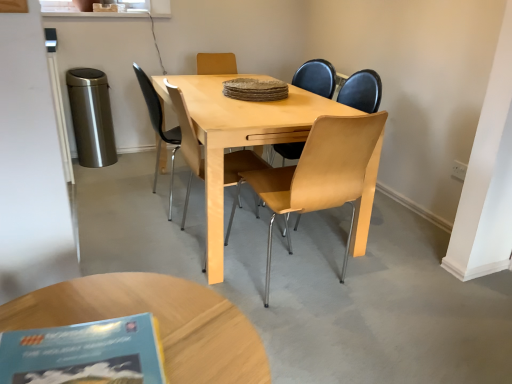
Image resolution: width=512 pixels, height=384 pixels. Describe the element at coordinates (159, 322) in the screenshot. I see `light brown wooden coffee table at lower center` at that location.

This screenshot has height=384, width=512. Describe the element at coordinates (187, 141) in the screenshot. I see `light brown wood chair at center, which is counted as the 2th chair, starting from the right` at that location.

Image resolution: width=512 pixels, height=384 pixels. In order to click on light wood/metallic chair at center, marked as the second chair in a left-to-right arrangement in this screenshot , I will do `click(317, 175)`.

Image resolution: width=512 pixels, height=384 pixels. Find the location of `light brown wooden coffee table at lower center`. light brown wooden coffee table at lower center is located at coordinates (159, 322).

Would you say light brown wooden coffee table at lower center is to the left or to the right of light brown wood chair at center, which is counted as the 2th chair, starting from the right, in the picture?

Based on their positions, light brown wooden coffee table at lower center is located to the left of light brown wood chair at center, which is counted as the 2th chair, starting from the right.

Is light brown wood chair at center, which is counted as the 2th chair, starting from the right, completely or partially inside light brown wooden coffee table at lower center?

That's incorrect, light brown wood chair at center, which is counted as the 2th chair, starting from the right, is not inside light brown wooden coffee table at lower center.

Considering the positions of points (165, 354) and (200, 152), is point (165, 354) closer to camera compared to point (200, 152)?

Yes, it is in front of point (200, 152).

Is light brown wood chair at center, positioned as the 1th chair in left-to-right order, far from light brown wooden coffee table at lower center?

Yes, light brown wood chair at center, positioned as the 1th chair in left-to-right order, and light brown wooden coffee table at lower center are located far from each other.

Which object is further away from the camera taking this photo, light brown wood chair at center, positioned as the 1th chair in left-to-right order, or light brown wooden coffee table at lower center?

light brown wood chair at center, positioned as the 1th chair in left-to-right order, is further away from the camera.

Does light brown wood chair at center, positioned as the 1th chair in left-to-right order, turn towards light brown wooden coffee table at lower center?

No, light brown wood chair at center, positioned as the 1th chair in left-to-right order, does not turn towards light brown wooden coffee table at lower center.

Consider the image. Can you tell me how much light brown wood chair at center, which is counted as the 2th chair, starting from the right, and light brown wooden coffee table at lower center differ in facing direction?

The facing directions of light brown wood chair at center, which is counted as the 2th chair, starting from the right, and light brown wooden coffee table at lower center are 89.2 degrees apart.

From a real-world perspective, is light brown wooden coffee table at lower center physically below blue paper book at lower left?

Yes, from a real-world perspective, light brown wooden coffee table at lower center is beneath blue paper book at lower left.

Is light brown wooden coffee table at lower center facing towards blue paper book at lower left?

No, light brown wooden coffee table at lower center is not oriented towards blue paper book at lower left.

You are a GUI agent. You are given a task and a screenshot of the screen. Output one action in this format:
    pyautogui.click(x=<x>, y=<y>)
    Task: Click on the coffee table below the blue paper book at lower left (from the image's perspective)
    
    Given the screenshot: What is the action you would take?
    pyautogui.click(x=159, y=322)

Is light brown wooden coffee table at lower center completely or partially outside of blue paper book at lower left?

Yes, light brown wooden coffee table at lower center is outside of blue paper book at lower left.

Is blue paper book at lower left inside or outside of light wood/metallic chair at center, marked as the second chair in a left-to-right arrangement?

blue paper book at lower left is not inside light wood/metallic chair at center, marked as the second chair in a left-to-right arrangement, it's outside.

Between blue paper book at lower left and light wood/metallic chair at center, the first chair in the right-to-left sequence, which one is positioned in front?

Positioned in front is blue paper book at lower left.

Does blue paper book at lower left have a lesser width compared to light wood/metallic chair at center, the first chair in the right-to-left sequence?

Indeed, blue paper book at lower left has a lesser width compared to light wood/metallic chair at center, the first chair in the right-to-left sequence.

From a real-world perspective, is blue paper book at lower left positioned above or below light wood/metallic chair at center, the first chair in the right-to-left sequence?

From a real-world perspective, blue paper book at lower left is physically above light wood/metallic chair at center, the first chair in the right-to-left sequence.

Which is nearer, (184, 213) or (344, 173)?

The point (344, 173) is in front.

In terms of height, does light brown wood chair at center, which is counted as the 2th chair, starting from the right, look taller or shorter compared to light wood/metallic chair at center, the first chair in the right-to-left sequence?

Clearly, light brown wood chair at center, which is counted as the 2th chair, starting from the right, is taller compared to light wood/metallic chair at center, the first chair in the right-to-left sequence.

From the image's perspective, which one is positioned higher, light brown wood chair at center, positioned as the 1th chair in left-to-right order, or light wood/metallic chair at center, marked as the second chair in a left-to-right arrangement?

light brown wood chair at center, positioned as the 1th chair in left-to-right order.

Considering the sizes of objects light brown wood chair at center, which is counted as the 2th chair, starting from the right, and light wood/metallic chair at center, the first chair in the right-to-left sequence, in the image provided, who is smaller, light brown wood chair at center, which is counted as the 2th chair, starting from the right, or light wood/metallic chair at center, the first chair in the right-to-left sequence,?

Smaller between the two is light brown wood chair at center, which is counted as the 2th chair, starting from the right.

In terms of size, does light brown wood chair at center, which is counted as the 2th chair, starting from the right, appear bigger or smaller than blue paper book at lower left?

In the image, light brown wood chair at center, which is counted as the 2th chair, starting from the right, appears to be larger than blue paper book at lower left.

Measure the distance between light brown wood chair at center, positioned as the 1th chair in left-to-right order, and blue paper book at lower left.

The distance of light brown wood chair at center, positioned as the 1th chair in left-to-right order, from blue paper book at lower left is 4.37 feet.

From the image's perspective, is light brown wood chair at center, which is counted as the 2th chair, starting from the right, on blue paper book at lower left?

Yes, from the image's perspective, light brown wood chair at center, which is counted as the 2th chair, starting from the right, is over blue paper book at lower left.

Are light brown wood chair at center, positioned as the 1th chair in left-to-right order, and blue paper book at lower left located far from each other?

Absolutely, light brown wood chair at center, positioned as the 1th chair in left-to-right order, is distant from blue paper book at lower left.

Is blue paper book at lower left surrounded by light wood/metallic chair at center, marked as the second chair in a left-to-right arrangement?

No, blue paper book at lower left is not surrounded by light wood/metallic chair at center, marked as the second chair in a left-to-right arrangement.

At what (x,y) coordinates should I click in order to perform the action: click on book in front of the light wood/metallic chair at center, the first chair in the right-to-left sequence. Please return your answer as a coordinate pair (x, y). The width and height of the screenshot is (512, 384). Looking at the image, I should click on (85, 353).

Considering the positions of point (266, 270) and point (41, 328), is point (266, 270) closer or farther from the camera than point (41, 328)?

Point (266, 270) appears to be farther away from the viewer than point (41, 328).

What's the angular difference between light wood/metallic chair at center, the first chair in the right-to-left sequence, and blue paper book at lower left's facing directions?

178 degrees separate the facing orientations of light wood/metallic chair at center, the first chair in the right-to-left sequence, and blue paper book at lower left.

Locate an element on the screen. The image size is (512, 384). the 1st chair counting from the right side of the light brown wooden coffee table at lower center is located at coordinates (187, 141).

Which chair is the 2nd one when counting from the back of the light brown wooden coffee table at lower center? Please provide its 2D coordinates.

[(187, 141)]

When comparing their distances from light brown wood chair at center, positioned as the 1th chair in left-to-right order, does blue paper book at lower left or light brown wooden coffee table at lower center seem further?

blue paper book at lower left.

Based on the photo, looking at the image, which one is located further to light brown wood chair at center, positioned as the 1th chair in left-to-right order, light wood/metallic chair at center, marked as the second chair in a left-to-right arrangement, or blue paper book at lower left?

The object further to light brown wood chair at center, positioned as the 1th chair in left-to-right order, is blue paper book at lower left.

Considering their positions, is blue paper book at lower left positioned further to light wood/metallic chair at center, the first chair in the right-to-left sequence, than light brown wood chair at center, positioned as the 1th chair in left-to-right order?

Based on the image, blue paper book at lower left appears to be further to light wood/metallic chair at center, the first chair in the right-to-left sequence.

When comparing their distances from blue paper book at lower left, does light wood/metallic chair at center, marked as the second chair in a left-to-right arrangement, or light brown wood chair at center, which is counted as the 2th chair, starting from the right, seem further?

Among the two, light brown wood chair at center, which is counted as the 2th chair, starting from the right, is located further to blue paper book at lower left.

Which object lies nearer to the anchor point light wood/metallic chair at center, the first chair in the right-to-left sequence, light brown wooden coffee table at lower center or blue paper book at lower left?

Among the two, light brown wooden coffee table at lower center is located nearer to light wood/metallic chair at center, the first chair in the right-to-left sequence.

Based on their spatial positions, is blue paper book at lower left or light wood/metallic chair at center, the first chair in the right-to-left sequence, closer to light brown wooden coffee table at lower center?

blue paper book at lower left is positioned closer to the anchor light brown wooden coffee table at lower center.

Considering their positions, is light wood/metallic chair at center, marked as the second chair in a left-to-right arrangement, positioned closer to blue paper book at lower left than light brown wooden coffee table at lower center?

light brown wooden coffee table at lower center is closer to blue paper book at lower left.

Estimate the real-world distances between objects in this image. Which object is closer to light brown wood chair at center, positioned as the 1th chair in left-to-right order, light brown wooden coffee table at lower center or light wood/metallic chair at center, marked as the second chair in a left-to-right arrangement?

light wood/metallic chair at center, marked as the second chair in a left-to-right arrangement.

Locate an element on the screen. This screenshot has height=384, width=512. coffee table positioned between blue paper book at lower left and light brown wood chair at center, positioned as the 1th chair in left-to-right order, from near to far is located at coordinates (159, 322).

You are a GUI agent. You are given a task and a screenshot of the screen. Output one action in this format:
    pyautogui.click(x=<x>, y=<y>)
    Task: Click on the chair between blue paper book at lower left and light brown wood chair at center, positioned as the 1th chair in left-to-right order, from front to back
    The height and width of the screenshot is (384, 512).
    Given the screenshot: What is the action you would take?
    pyautogui.click(x=317, y=175)

Image resolution: width=512 pixels, height=384 pixels. What are the coordinates of `coffee table between blue paper book at lower left and light wood/metallic chair at center, marked as the second chair in a left-to-right arrangement, from front to back` in the screenshot? It's located at (159, 322).

In order to click on chair positioned between light brown wooden coffee table at lower center and light brown wood chair at center, which is counted as the 2th chair, starting from the right, from near to far in this screenshot , I will do `click(317, 175)`.